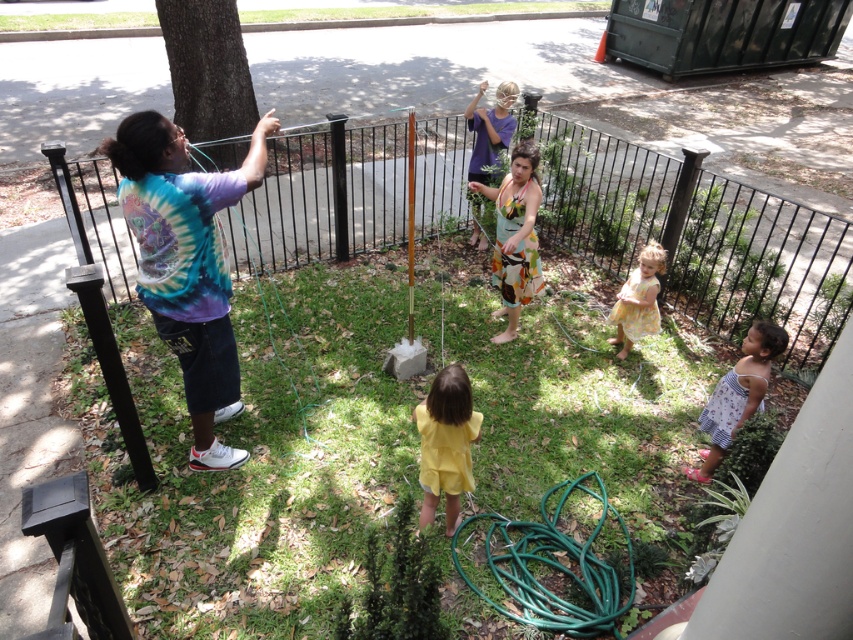
You are a fashion designer observing two dresses in an outdoor photoshoot. You need to determine which dress is taller. The scene includes a grassy area with a black metal fence, a tree trunk on the left, a coiled green garden hose, and a small concrete block with a wooden post. Which dress, the printed cotton dress at lower right or the yellow floral dress at center, has a greater height?

The printed cotton dress at lower right has a greater height compared to the yellow floral dress at center according to the description.

Looking at this image, you are a stylist organizing a fashion show. You have two dresses to display on mannequins of the same size. The printed cotton dress at lower right and the yellow floral dress at center. Which dress will require a larger mannequin?

The printed cotton dress at lower right has a larger size compared to the yellow floral dress at center, so it will require a larger mannequin.